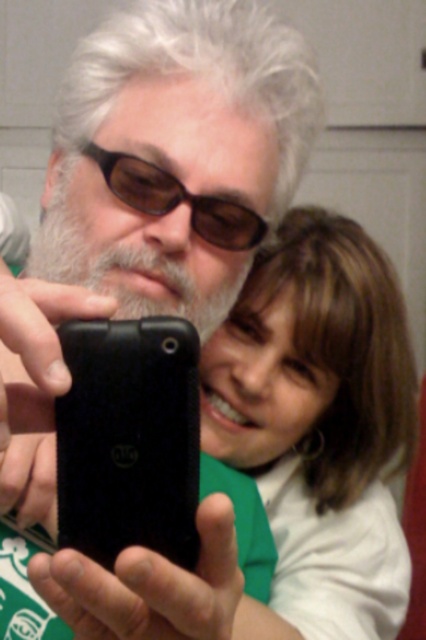
Between black matte phone at center and white matte beard at center, which one appears on the right side from the viewer's perspective?

black matte phone at center

Is black matte phone at center taller than white matte beard at center?

Correct, black matte phone at center is much taller as white matte beard at center.

The height and width of the screenshot is (640, 426). What do you see at coordinates (175, 156) in the screenshot? I see `black matte phone at center` at bounding box center [175, 156].

I want to click on black matte phone at center, so click(175, 156).

Is point (253, 51) positioned after point (397, 444)?

No, (253, 51) is in front of (397, 444).

Is black matte phone at center smaller than white matte hair at upper center?

Correct, black matte phone at center occupies less space than white matte hair at upper center.

From the picture: Measure the distance between point (166, 276) and camera.

Point (166, 276) and camera are 18.58 inches apart from each other.

Identify the location of black matte phone at center. This screenshot has width=426, height=640. (175, 156).

Which of these two, white matte hair at upper center or black matte smartphone at center, stands shorter?

Standing shorter between the two is black matte smartphone at center.

Does white matte hair at upper center have a smaller size compared to black matte smartphone at center?

Actually, white matte hair at upper center might be larger than black matte smartphone at center.

What do you see at coordinates (319, 422) in the screenshot?
I see `white matte hair at upper center` at bounding box center [319, 422].

The width and height of the screenshot is (426, 640). In order to click on white matte hair at upper center in this screenshot , I will do `click(319, 422)`.